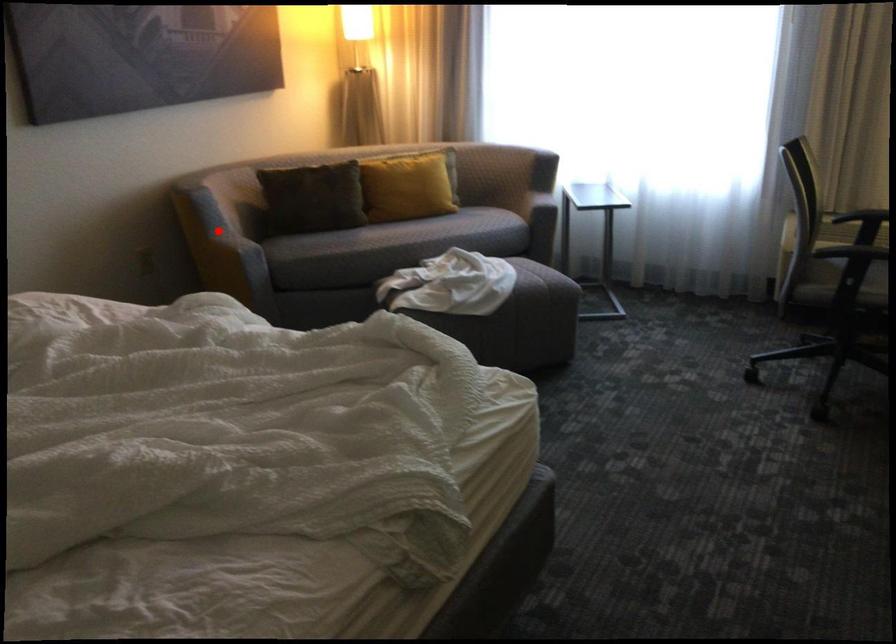
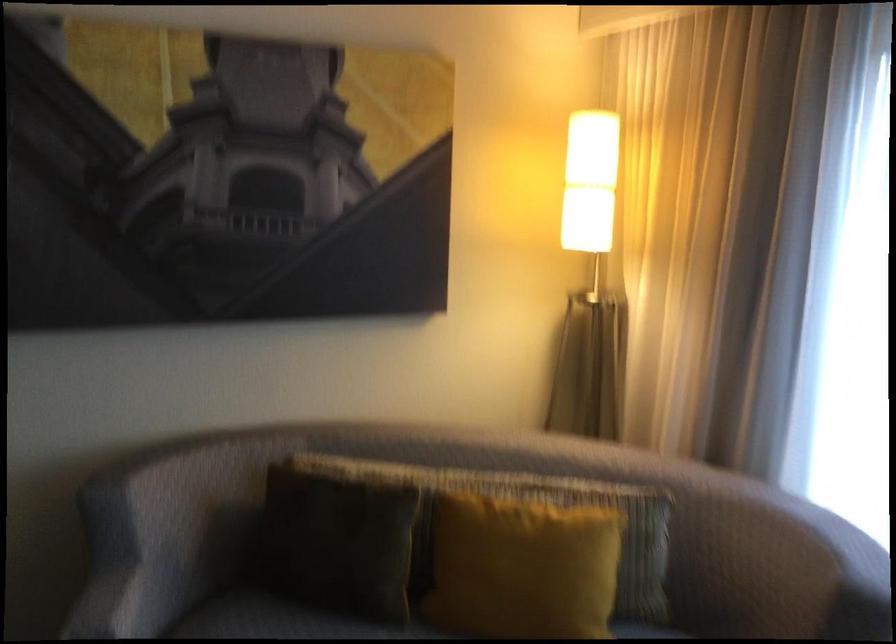
In the second image, find the point that corresponds to the highlighted location in the first image.

(119, 569)